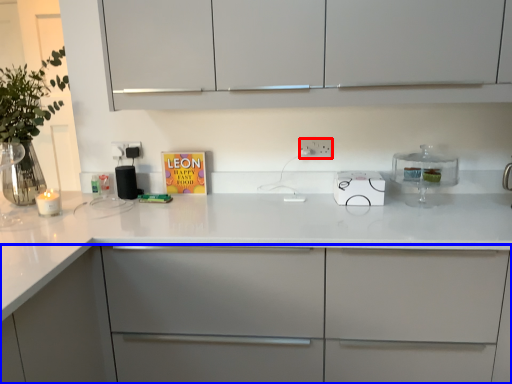
Question: Which point is further to the camera, electric outlet (highlighted by a red box) or cabinetry (highlighted by a blue box)?

Choices:
 (A) electric outlet
 (B) cabinetry

Answer: (A)